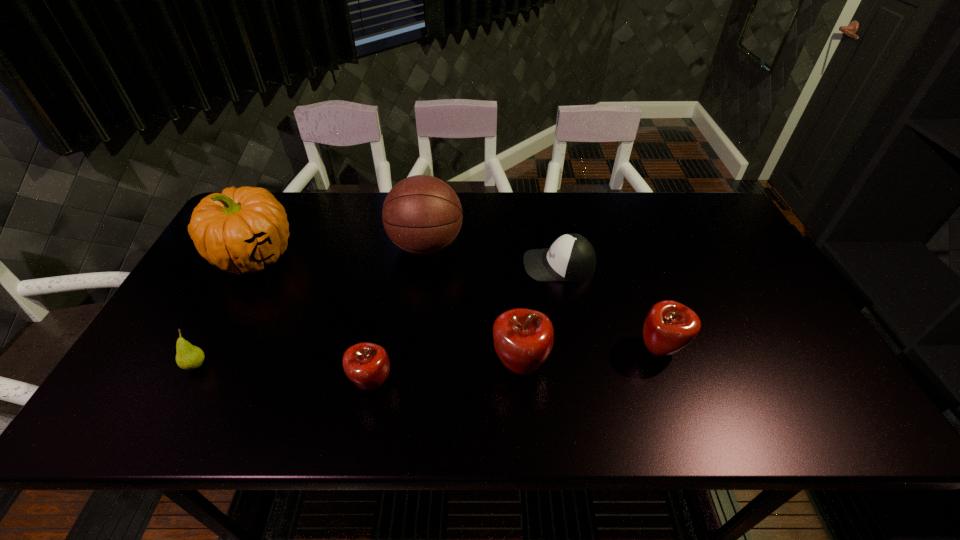
Identify the location of free space between the pumpkin and the second apple from left to right. The width and height of the screenshot is (960, 540). (388, 311).

Image resolution: width=960 pixels, height=540 pixels. I want to click on empty space between the pear and the basketball, so click(x=311, y=306).

The height and width of the screenshot is (540, 960). I want to click on vacant area between the second apple from right to left and the pumpkin, so click(388, 311).

The image size is (960, 540). Find the location of `free point between the second apple from left to right and the basketball`. free point between the second apple from left to right and the basketball is located at coordinates (473, 306).

Where is `free point between the leftmost apple and the pumpkin`? The image size is (960, 540). free point between the leftmost apple and the pumpkin is located at coordinates (313, 320).

Identify the location of free spot between the pumpkin and the pear. (226, 310).

Where is `free area in between the basketball and the leftmost apple`? This screenshot has height=540, width=960. free area in between the basketball and the leftmost apple is located at coordinates (399, 315).

Locate which object ranks sixth in proximity to the basketball. Please provide its 2D coordinates. Your answer should be formatted as a tuple, i.e. [(x, y)], where the tuple contains the x and y coordinates of a point satisfying the conditions above.

[(669, 327)]

Find the location of `object that is the fourth closest to the cap`. object that is the fourth closest to the cap is located at coordinates (366, 364).

Locate which apple is the closest to the leftmost apple. Please provide its 2D coordinates. Your answer should be formatted as a tuple, i.e. [(x, y)], where the tuple contains the x and y coordinates of a point satisfying the conditions above.

[(523, 338)]